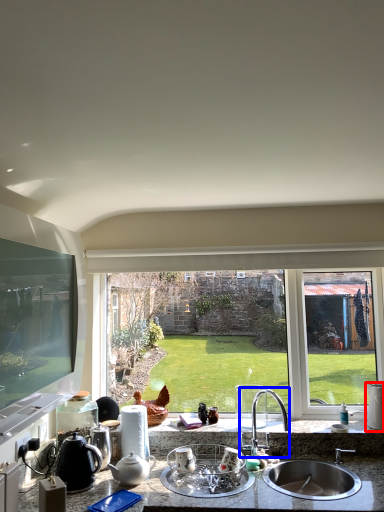
Question: Which object is further to the camera taking this photo, appliance (highlighted by a red box) or tap (highlighted by a blue box)?

Choices:
 (A) appliance
 (B) tap

Answer: (A)